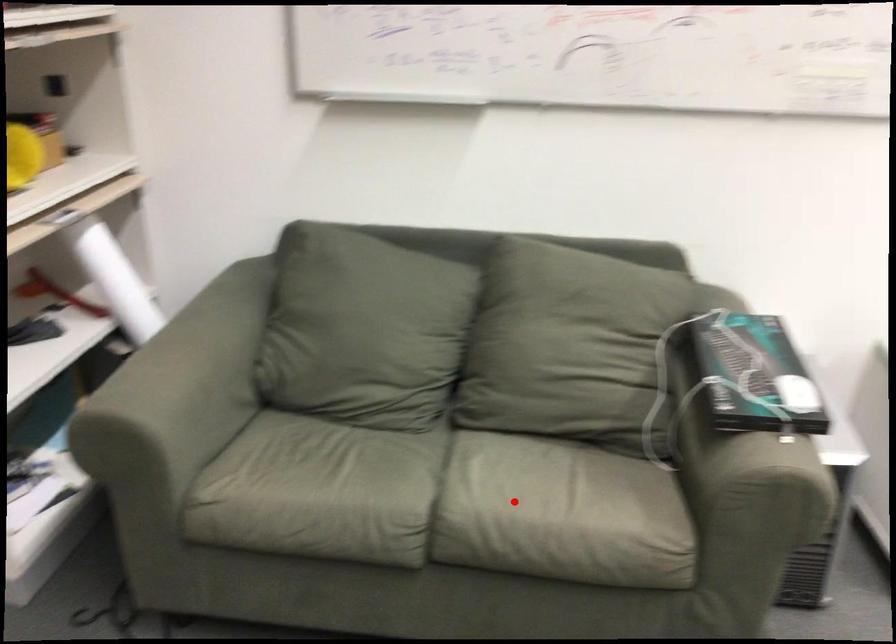
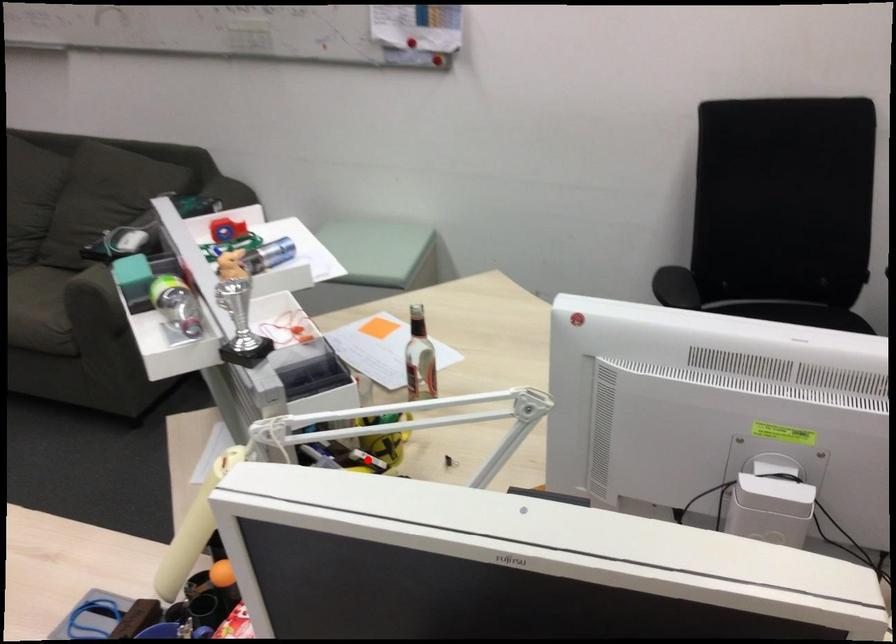
I am providing you with two images of the same scene from different viewpoints. A red point is marked on the first image and another point is marked on the second image. Is the red point in image1 aligned with the point shown in image2?

No